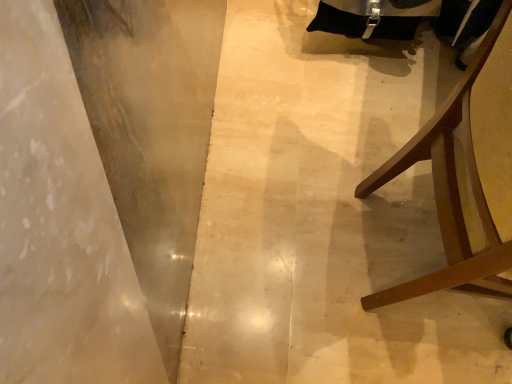
This screenshot has height=384, width=512. Find the location of `free space to the left of brown wood chair at right`. free space to the left of brown wood chair at right is located at coordinates (271, 224).